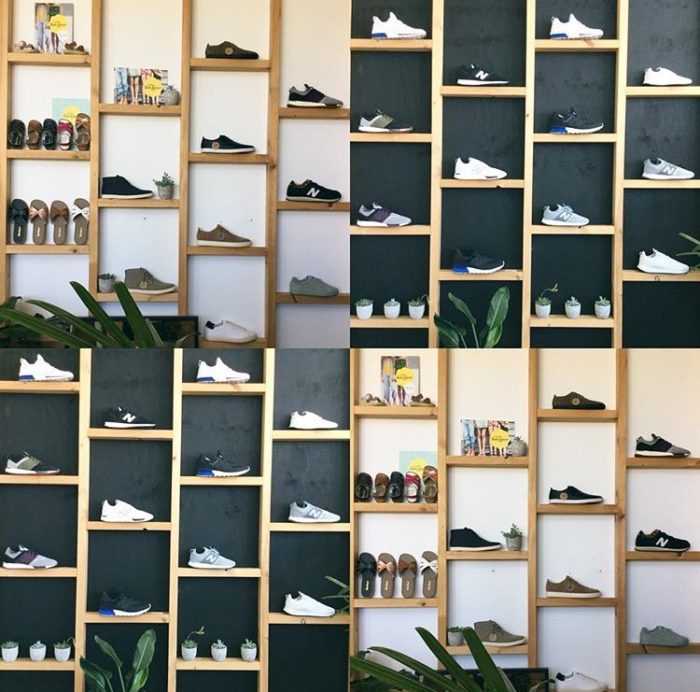
Where is `plant`? The image size is (700, 692). plant is located at coordinates tap(138, 668), tap(449, 677), tap(494, 304), tap(136, 326), tap(507, 540), tap(164, 190).